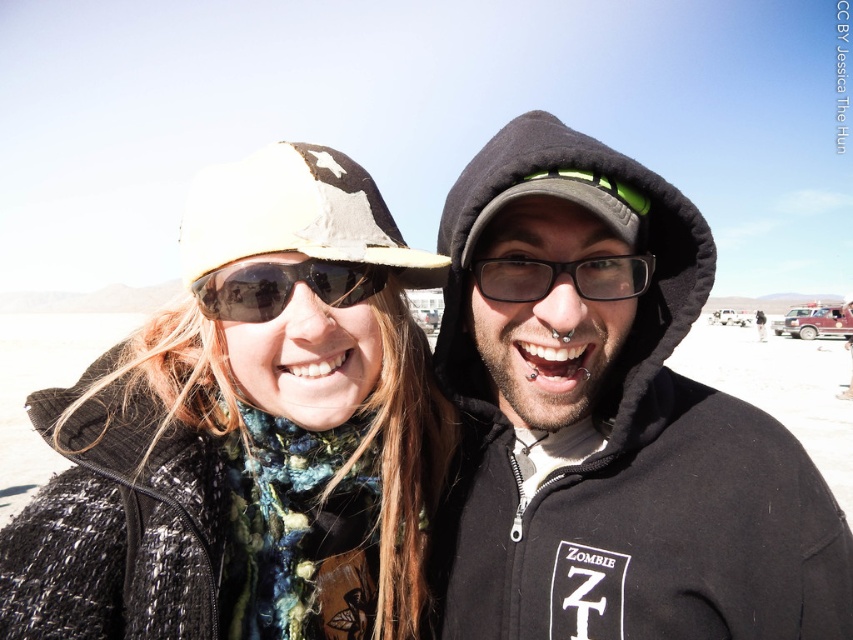
You are a photographer trying to capture a closeup shot of both the black hoodie at center and the black plastic glasses at center. Since you want to focus on the details of the hoodie and glasses, which object should you adjust your camera focus to first if you want to ensure both are in focus given their sizes?

The black hoodie at center is wider than the black plastic glasses at center, so you should focus on the black hoodie at center first to ensure both are in focus.

You are a photographer trying to capture a closeup shot of both the black hoodie at center and the knitted scarf at center. Since you want to ensure both are visible in the frame, which object should you focus on first to account for their size difference?

The black hoodie at center is larger than the knitted scarf at center, so you should focus on the black hoodie at center first to ensure its details are sharp before adjusting for the smaller knitted scarf at center.

You are a photographer trying to capture a closeup of the knitted scarf at center and the black plastic glasses at center. Which object will require you to zoom in more to fill the frame?

The knitted scarf at center is wider than the black plastic glasses at center, so you will need to zoom in less to fill the frame with the scarf compared to the glasses. Therefore, the black plastic glasses at center will require more zoom to fill the frame.